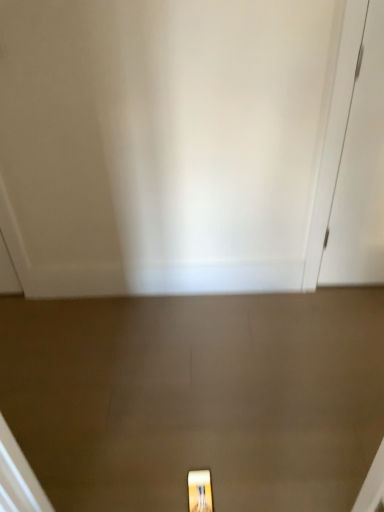
Question: From a real-world perspective, is matte gold light fixture at lower center positioned above or below white matte door at right, placed as the 1th door when sorted from back to front?

Choices:
 (A) above
 (B) below

Answer: (B)

Question: From the image's perspective, is matte gold light fixture at lower center located above or below white matte door at right, placed as the 1th door when sorted from back to front?

Choices:
 (A) below
 (B) above

Answer: (A)

Question: Estimate the real-world distances between objects in this image. Which object is farther from the matte gold light fixture at lower center?

Choices:
 (A) white matte door at right, marked as the second door in a left-to-right arrangement
 (B) white glossy door at center, which is the 1th door from front to back

Answer: (A)

Question: Which of these objects is positioned farthest from the white matte door at right, marked as the second door in a left-to-right arrangement?

Choices:
 (A) matte gold light fixture at lower center
 (B) white glossy door at center, which is the 1th door from left to right

Answer: (A)